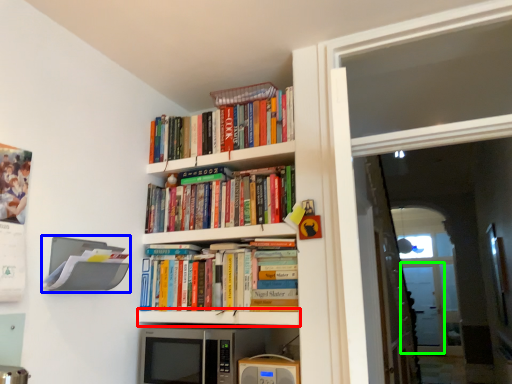
Question: Considering the real-world distances, which object is closest to shelf (highlighted by a red box)? shelf (highlighted by a blue box) or screen door (highlighted by a green box).

Choices:
 (A) shelf
 (B) screen door

Answer: (A)